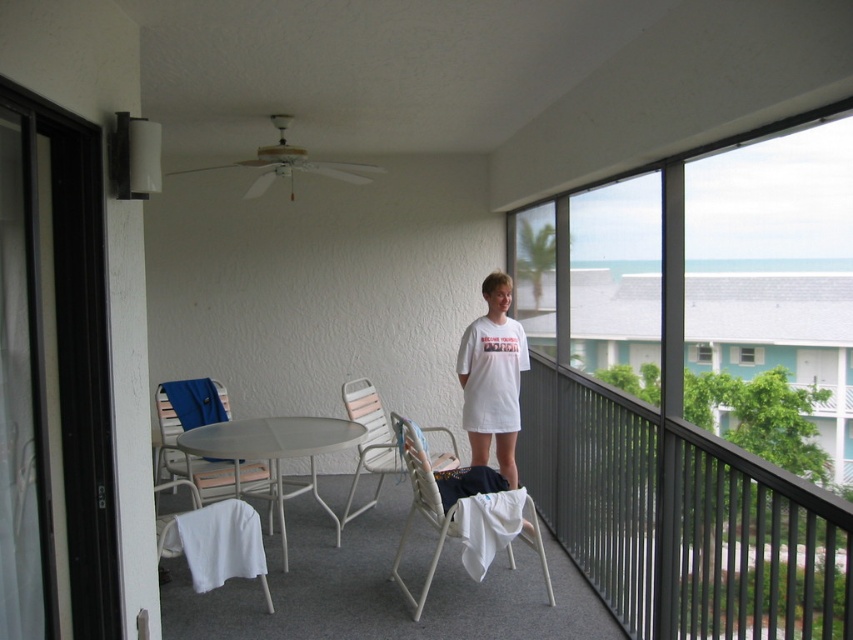
You are standing on the balcony and want to place a potted plant between the white plastic chairs at center and the white metal table at center. Which object should the plant be closer to if you want it to be nearer to the viewer?

The plant should be placed closer to the white plastic chairs at center because they are closer to the viewer than the white metal table at center.

From the picture: You are standing on the balcony and want to place a 10 feet long ladder. Is there enough space between the railing and the point at coordinates (x=437, y=474) to place it?

The distance of point (x=437, y=474) from camera is 12.41 feet, so yes, there is enough space to place a 10 feet long ladder between the railing and the point at coordinates (x=437, y=474) since the distance is greater than the ladder length.

You are standing on the balcony and want to sit on the white plastic chair at lower center. What is the exact position of the chair relative to the balcony railing?

The white plastic chair at lower center is located at point [463,520] relative to the balcony railing.